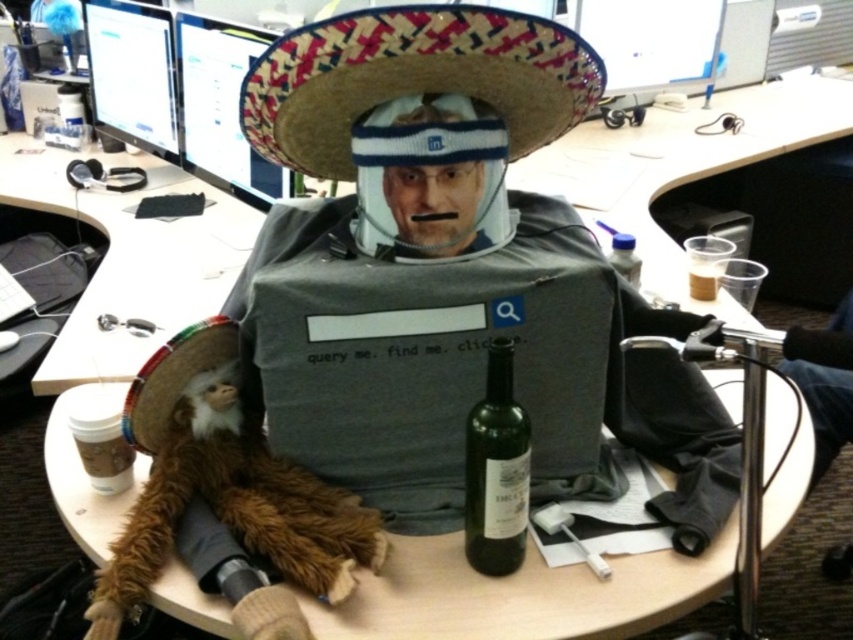
You are a delivery person standing 30 inches away from the desk. You need to place a package on the desk without moving closer. Can you safely place the package on the desk if the package requires a minimum of 2 inches of clearance from the woven straw sombrero at center?

The woven straw sombrero at center is 28.44 inches away from the viewer. Since you are standing 30 inches away, there is a 1.56 inch difference. This means the sombrero is slightly closer to you than your current position. However, the required clearance is 2 inches. Therefore, placing the package without moving closer may not provide enough space. You might need to adjust your position or ensure the package is placed further back to meet the clearance requirement.

You are organizing a themed party and need to arrange decorations. You have a woven straw sombrero at center and a green glass bottle at center. Which one should you place on a shelf that requires a taller object to balance the display?

The green glass bottle at center should be placed on the shelf because it is taller than the woven straw sombrero at center, which will help balance the display.

You are a delivery robot in the office and need to place a package on the desk. The package must be placed exactly at the coordinates of the woven straw sombrero at center. What are the coordinates where you should place the package?

The coordinates for the woven straw sombrero at center are at point (419,113), so the package should be placed there.